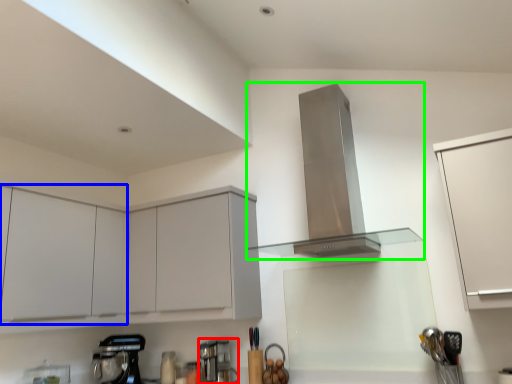
Question: Which object is positioned closest to coffee machine (highlighted by a red box)? Select from cabinetry (highlighted by a blue box) and home appliance (highlighted by a green box).

Choices:
 (A) cabinetry
 (B) home appliance

Answer: (A)